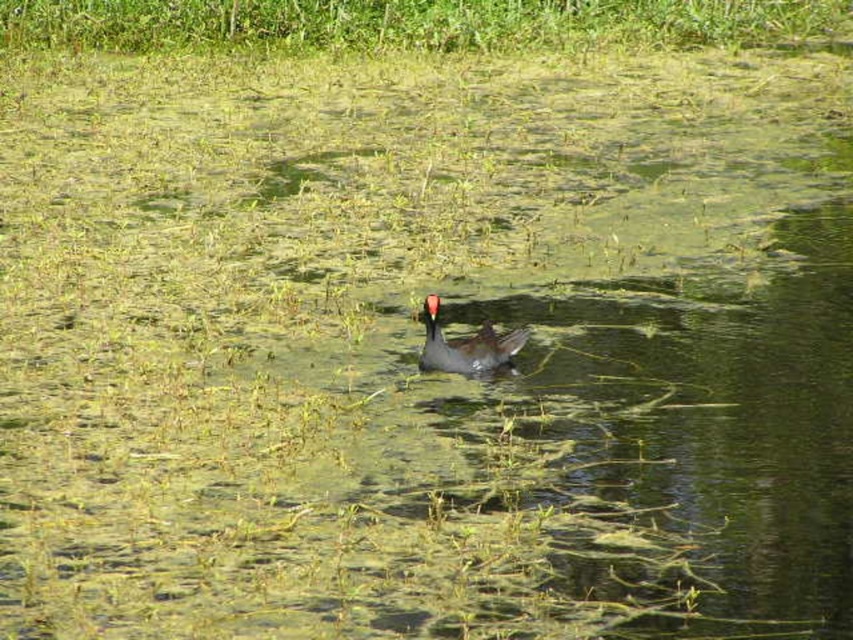
You are a photographer aiming to capture the dark gray duck at center and the green leafy grass at upper center in your shot. Which object is located to the left of the other?

The green leafy grass at upper center is positioned on the left side of dark gray duck at center.

You are standing at the edge of the wetland and see two points in the scene, point (71,20) and point (485,323). Which point is closer to your current position?

Point (71,20) is closer to your current position because it is further to the viewer than point (485,323).